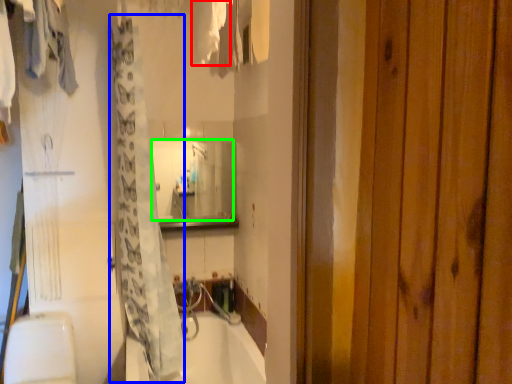
Question: Considering the real-world distances, which object is closest to clothing (highlighted by a red box)? shower curtain (highlighted by a blue box) or mirror (highlighted by a green box).

Choices:
 (A) shower curtain
 (B) mirror

Answer: (A)